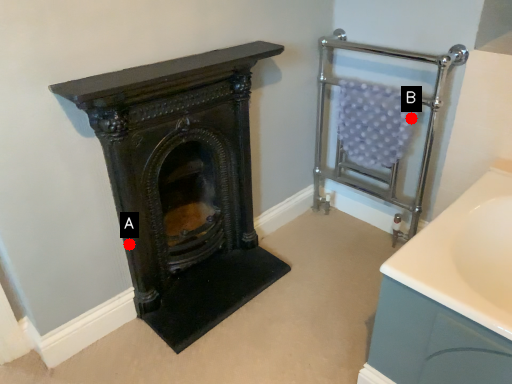
Question: Two points are circled on the image, labeled by A and B beside each circle. Which point is further to the camera?

Choices:
 (A) A is further
 (B) B is further

Answer: (B)